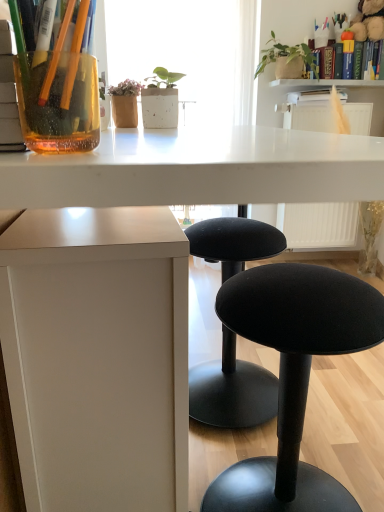
What are the coordinates of `hardcover book at upper right, which ranks as the first book in top-to-bottom order` in the screenshot? It's located at pos(335,59).

Describe the element at coordinates (335, 59) in the screenshot. Image resolution: width=384 pixels, height=512 pixels. I see `hardcover book at upper right, the first book from the right` at that location.

This screenshot has width=384, height=512. What do you see at coordinates (293, 375) in the screenshot?
I see `black fabric stool at lower right` at bounding box center [293, 375].

Image resolution: width=384 pixels, height=512 pixels. What are the coordinates of `translucent orange glass at upper left` in the screenshot? It's located at (59, 103).

Image resolution: width=384 pixels, height=512 pixels. What do you see at coordinates (59, 103) in the screenshot? I see `translucent orange glass at upper left` at bounding box center [59, 103].

The image size is (384, 512). What do you see at coordinates (322, 83) in the screenshot? I see `white textured shelf at upper center` at bounding box center [322, 83].

In order to click on green matte plant at upper right in this screenshot , I will do `click(286, 55)`.

This screenshot has height=512, width=384. Describe the element at coordinates (318, 224) in the screenshot. I see `white plastic radiator at upper right` at that location.

Find the location of a particular element. This screenshot has width=384, height=512. hardcover book at upper right, the second book positioned from the left is located at coordinates (335, 59).

Is white textured shelf at upper center not near white plastic radiator at upper right?

No, white textured shelf at upper center is not far from white plastic radiator at upper right.

From a real-world perspective, relative to white plastic radiator at upper right, is white textured shelf at upper center vertically above or below?

white textured shelf at upper center is situated higher than white plastic radiator at upper right in the real world.

Looking at this image, can you confirm if white textured shelf at upper center is shorter than white plastic radiator at upper right?

Yes, white textured shelf at upper center is shorter than white plastic radiator at upper right.

Which is in front, white textured shelf at upper center or white plastic radiator at upper right?

white plastic radiator at upper right is in front.

Is green matte plant at upper right inside or outside of translucent orange glass at upper left?

green matte plant at upper right exists outside the volume of translucent orange glass at upper left.

Who is shorter, green matte plant at upper right or translucent orange glass at upper left?

translucent orange glass at upper left is shorter.

Could you tell me if green matte plant at upper right is facing translucent orange glass at upper left?

Yes, green matte plant at upper right faces towards translucent orange glass at upper left.

How different are the orientations of green matte plant at upper right and hardcover book at upper center, the 1th book in the bottom-to-top sequence, in degrees?

The angle between the facing direction of green matte plant at upper right and the facing direction of hardcover book at upper center, the 1th book in the bottom-to-top sequence, is 3.09 degrees.

From the image's perspective, is green matte plant at upper right located above hardcover book at upper center, acting as the second book starting from the top?

Yes, from the image's perspective, green matte plant at upper right is over hardcover book at upper center, acting as the second book starting from the top.

Considering the sizes of objects green matte plant at upper right and hardcover book at upper center, which is counted as the 2th book, starting from the right, in the image provided, who is taller, green matte plant at upper right or hardcover book at upper center, which is counted as the 2th book, starting from the right,?

green matte plant at upper right is taller.

Is green matte plant at upper right far away from hardcover book at upper center, the 1th book in the bottom-to-top sequence?

That's not correct — green matte plant at upper right is a little close to hardcover book at upper center, the 1th book in the bottom-to-top sequence.

From the image's perspective, is hardcover book at upper right, the first book from the right, under hardcover book at upper center, arranged as the first book when viewed from the left?

Incorrect, from the image's perspective, hardcover book at upper right, the first book from the right, is higher than hardcover book at upper center, arranged as the first book when viewed from the left.

From a real-world perspective, which is physically below, hardcover book at upper right, which ranks as the first book in top-to-bottom order, or hardcover book at upper center, which is counted as the 2th book, starting from the right?

hardcover book at upper center, which is counted as the 2th book, starting from the right.

Between hardcover book at upper right, which ranks as the first book in top-to-bottom order, and hardcover book at upper center, acting as the second book starting from the top, which one has smaller size?

hardcover book at upper center, acting as the second book starting from the top.

Find the location of a particular element. book that appears behind the hardcover book at upper right, which ranks as the first book in top-to-bottom order is located at coordinates (309, 96).

From a real-world perspective, which object stands above the other?

green matte plant at upper right is physically above.

Does white plastic radiator at upper right appear on the right side of green matte plant at upper right?

Yes.

Is white plastic radiator at upper right wider than green matte plant at upper right?

Yes.

Choose the correct answer: Is white plastic radiator at upper right inside green matte plant at upper right or outside it?

white plastic radiator at upper right is spatially situated outside green matte plant at upper right.

In the scene shown: How far apart are black fabric stool at lower right and white textured shelf at upper center?

black fabric stool at lower right and white textured shelf at upper center are 2.13 meters apart from each other.

Can you confirm if black fabric stool at lower right is positioned to the right of white textured shelf at upper center?

No.

How different are the orientations of black fabric stool at lower right and white textured shelf at upper center in degrees?

The angle between the facing direction of black fabric stool at lower right and the facing direction of white textured shelf at upper center is 92.6 degrees.

Who is bigger, black fabric stool at lower right or white textured shelf at upper center?

With larger size is black fabric stool at lower right.

Could you tell me if hardcover book at upper right, the second book positioned from the left, is turned towards translucent orange glass at upper left?

No, hardcover book at upper right, the second book positioned from the left, does not turn towards translucent orange glass at upper left.

Which object is further away from the camera taking this photo, hardcover book at upper right, the 2th book positioned from the bottom, or translucent orange glass at upper left?

hardcover book at upper right, the 2th book positioned from the bottom, is more distant.

From the image's perspective, would you say hardcover book at upper right, the second book positioned from the left, is positioned over translucent orange glass at upper left?

Yes, from the image's perspective, hardcover book at upper right, the second book positioned from the left, is above translucent orange glass at upper left.

You are a GUI agent. You are given a task and a screenshot of the screen. Output one action in this format:
    pyautogui.click(x=<x>, y=<y>)
    Task: Click on the radiator directly beneath the white textured shelf at upper center (from a real-world perspective)
    
    Given the screenshot: What is the action you would take?
    pyautogui.click(x=318, y=224)

This screenshot has width=384, height=512. In the image, there is a translucent orange glass at upper left. In order to click on houseplant above it (from the image's perspective) in this screenshot , I will do `click(286, 55)`.

Considering their positions, is hardcover book at upper center, arranged as the first book when viewed from the left, positioned closer to translucent orange glass at upper left than green matte plant at upper right?

green matte plant at upper right lies closer to translucent orange glass at upper left than the other object.

Which object lies further to the anchor point white textured shelf at upper center, green matte plant at upper right or black fabric stool at lower right?

black fabric stool at lower right is positioned further to the anchor white textured shelf at upper center.

Considering their positions, is white plastic radiator at upper right positioned closer to hardcover book at upper right, the second book positioned from the left, than black fabric stool at lower right?

The object closer to hardcover book at upper right, the second book positioned from the left, is white plastic radiator at upper right.

Estimate the real-world distances between objects in this image. Which object is closer to white plastic radiator at upper right, green matte plant at upper right or black fabric stool at lower right?

green matte plant at upper right is closer to white plastic radiator at upper right.

From the image, which object appears to be nearer to green matte plant at upper right, black fabric stool at lower right or hardcover book at upper center, which is counted as the 2th book, starting from the right?

Based on the image, hardcover book at upper center, which is counted as the 2th book, starting from the right, appears to be nearer to green matte plant at upper right.

Estimate the real-world distances between objects in this image. Which object is closer to black fabric stool at lower right, hardcover book at upper center, which is counted as the 2th book, starting from the right, or translucent orange glass at upper left?

translucent orange glass at upper left is positioned closer to the anchor black fabric stool at lower right.

Estimate the real-world distances between objects in this image. Which object is closer to hardcover book at upper center, acting as the second book starting from the top, translucent orange glass at upper left or white plastic radiator at upper right?

white plastic radiator at upper right is closer to hardcover book at upper center, acting as the second book starting from the top.

In the scene shown: Which object lies further to the anchor point green matte plant at upper right, white plastic radiator at upper right or translucent orange glass at upper left?

The object further to green matte plant at upper right is translucent orange glass at upper left.

Locate an element on the screen. The image size is (384, 512). book located between black fabric stool at lower right and hardcover book at upper center, arranged as the first book when viewed from the left, in the depth direction is located at coordinates (335, 59).

At what (x,y) coordinates should I click in order to perform the action: click on book situated between green matte plant at upper right and white textured shelf at upper center from left to right. Please return your answer as a coordinate pair (x, y). Looking at the image, I should click on (309, 96).

Find the location of a particular element. The image size is (384, 512). radiator between black fabric stool at lower right and green matte plant at upper right from front to back is located at coordinates (318, 224).

Identify the location of houseplant between black fabric stool at lower right and white textured shelf at upper center in the front-back direction. This screenshot has width=384, height=512. pos(286,55).